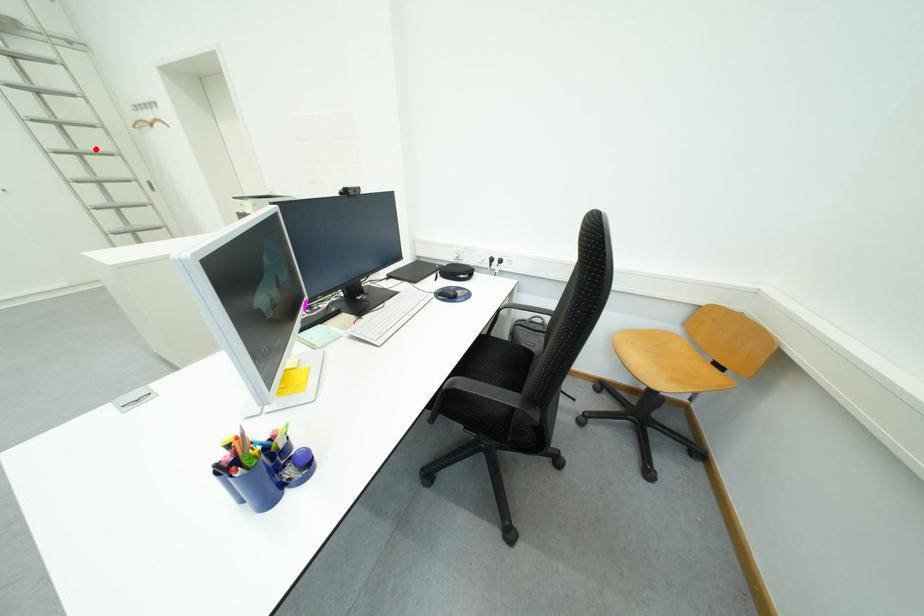
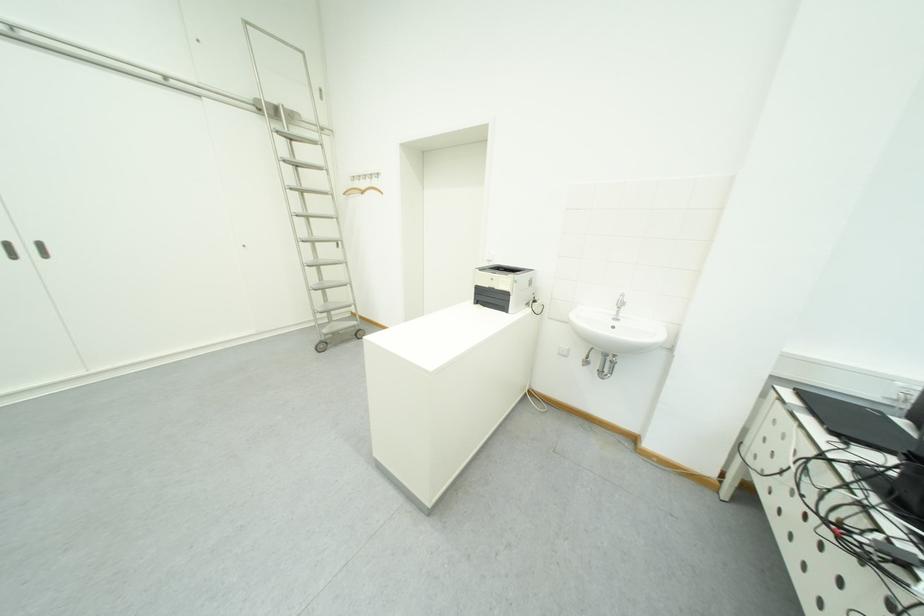
Question: I am providing you with two images of the same scene from different viewpoints. Image1 has a red point marked. In image2, the corresponding 3D location appears at what relative position? Reply with the corresponding letter.

Choices:
 (A) Closer
 (B) Farther

Answer: (A)